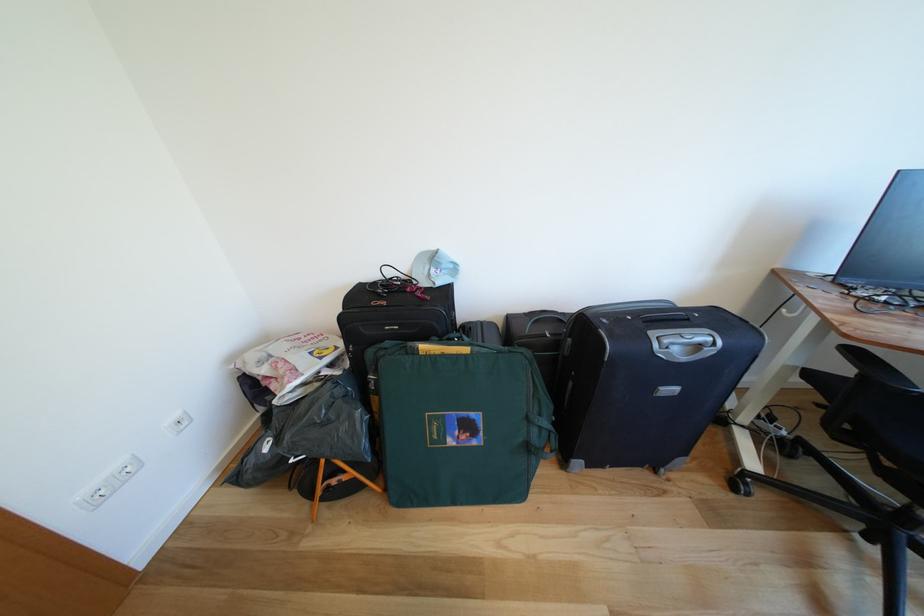
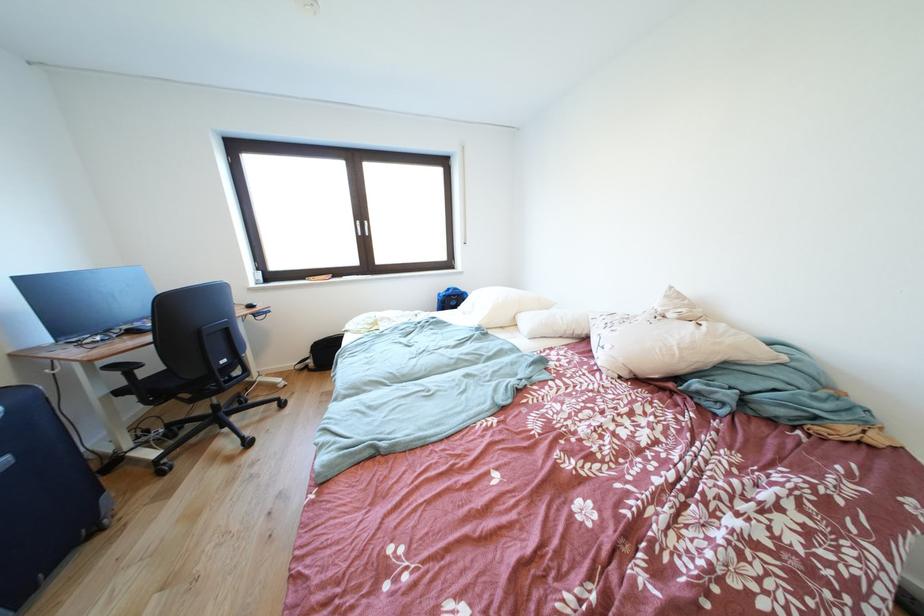
Locate, in the second image, the point that corresponds to [862,357] in the first image.

(120, 371)